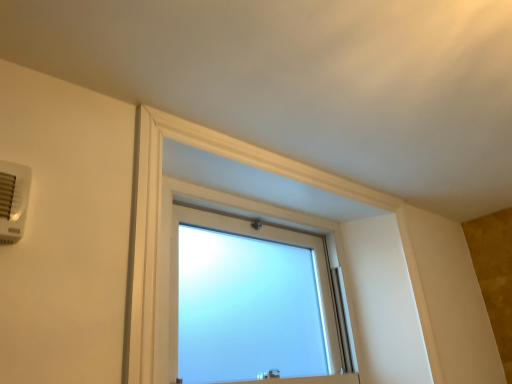
In order to face frosted glass window at upper center, should I rotate leftwards or rightwards?

You should look right and rotate roughly 8.409 degrees.

Where is `white plastic air conditioning unit at upper left`? This screenshot has height=384, width=512. white plastic air conditioning unit at upper left is located at coordinates (13, 200).

What is the approximate width of frosted glass window at center?

frosted glass window at center is 3.71 inches wide.

The image size is (512, 384). Find the location of `frosted glass window at upper center`. frosted glass window at upper center is located at coordinates (159, 219).

Considering their positions, is white plastic air conditioning unit at upper left located in front of or behind frosted glass window at center?

In the image, white plastic air conditioning unit at upper left appears in front of frosted glass window at center.

Is point (4, 193) farther from viewer compared to point (258, 363)?

No, (4, 193) is closer to viewer.

How distant is white plastic air conditioning unit at upper left from frosted glass window at center?

white plastic air conditioning unit at upper left and frosted glass window at center are 36.18 inches apart.

Is white plastic air conditioning unit at upper left far away from frosted glass window at center?

Actually, white plastic air conditioning unit at upper left and frosted glass window at center are a little close together.

Which point is more distant from viewer, (30, 175) or (161, 189)?

Positioned behind is point (161, 189).

From a real-world perspective, is white plastic air conditioning unit at upper left above or below frosted glass window at upper center?

In terms of real-world spatial position, white plastic air conditioning unit at upper left is above frosted glass window at upper center.

From the image's perspective, which object appears higher, white plastic air conditioning unit at upper left or frosted glass window at upper center?

From the image's view, white plastic air conditioning unit at upper left is above.

From a real-world perspective, is frosted glass window at center located beneath white plastic air conditioning unit at upper left?

Yes, from a real-world perspective, frosted glass window at center is beneath white plastic air conditioning unit at upper left.

Considering the positions of objects frosted glass window at center and white plastic air conditioning unit at upper left in the image provided, who is behind, frosted glass window at center or white plastic air conditioning unit at upper left?

frosted glass window at center is further away from the camera.

Is frosted glass window at center positioned with its back to white plastic air conditioning unit at upper left?

No, frosted glass window at center is not facing away from white plastic air conditioning unit at upper left.

In the scene shown: Which is closer, [227,308] or [0,174]?

The point [0,174] is closer.

Can you confirm if frosted glass window at upper center is bigger than frosted glass window at center?

No.

From the image's perspective, which object appears higher, frosted glass window at upper center or frosted glass window at center?

frosted glass window at upper center is shown above in the image.

From a real-world perspective, is frosted glass window at upper center positioned under frosted glass window at center based on gravity?

Incorrect, from a real-world perspective, frosted glass window at upper center is higher than frosted glass window at center.

Based on their positions, is frosted glass window at upper center located to the left or right of frosted glass window at center?

Clearly, frosted glass window at upper center is on the right of frosted glass window at center in the image.

How many degrees apart are the facing directions of frosted glass window at center and frosted glass window at upper center?

The angular difference between frosted glass window at center and frosted glass window at upper center is 0.00699 degrees.

Considering the sizes of objects frosted glass window at center and frosted glass window at upper center in the image provided, who is shorter, frosted glass window at center or frosted glass window at upper center?

Standing shorter between the two is frosted glass window at center.

In the scene shown: Which object is more forward, frosted glass window at center or frosted glass window at upper center?

frosted glass window at upper center is closer to the camera.

Which is farther from the camera, (311,370) or (134,161)?

The point (311,370) is farther from the camera.

Considering the positions of objects frosted glass window at upper center and white plastic air conditioning unit at upper left in the image provided, who is in front, frosted glass window at upper center or white plastic air conditioning unit at upper left?

white plastic air conditioning unit at upper left is in front.

Can you tell me how much frosted glass window at upper center and white plastic air conditioning unit at upper left differ in facing direction?

1.26 degrees.

Is white plastic air conditioning unit at upper left at the back of frosted glass window at upper center?

No, white plastic air conditioning unit at upper left is not at the back of frosted glass window at upper center.

Considering the sizes of objects frosted glass window at upper center and white plastic air conditioning unit at upper left in the image provided, who is bigger, frosted glass window at upper center or white plastic air conditioning unit at upper left?

frosted glass window at upper center.

Find the location of `window behind the white plastic air conditioning unit at upper left`. window behind the white plastic air conditioning unit at upper left is located at coordinates (247, 301).

The image size is (512, 384). I want to click on bay window located below the white plastic air conditioning unit at upper left (from the image's perspective), so click(159, 219).

From the image, which object appears to be nearer to frosted glass window at center, frosted glass window at upper center or white plastic air conditioning unit at upper left?

frosted glass window at upper center is positioned closer to the anchor frosted glass window at center.

From the image, which object appears to be nearer to white plastic air conditioning unit at upper left, frosted glass window at upper center or frosted glass window at center?

frosted glass window at upper center lies closer to white plastic air conditioning unit at upper left than the other object.

Estimate the real-world distances between objects in this image. Which object is closer to white plastic air conditioning unit at upper left, frosted glass window at center or frosted glass window at upper center?

frosted glass window at upper center is positioned closer to the anchor white plastic air conditioning unit at upper left.

Considering their positions, is white plastic air conditioning unit at upper left positioned further to frosted glass window at upper center than frosted glass window at center?

white plastic air conditioning unit at upper left.

Considering their positions, is frosted glass window at center positioned further to frosted glass window at upper center than white plastic air conditioning unit at upper left?

white plastic air conditioning unit at upper left.

Looking at the image, which one is located closer to frosted glass window at center, white plastic air conditioning unit at upper left or frosted glass window at upper center?

Based on the image, frosted glass window at upper center appears to be nearer to frosted glass window at center.

At what (x,y) coordinates should I click in order to perform the action: click on window located between white plastic air conditioning unit at upper left and frosted glass window at upper center in the left-right direction. Please return your answer as a coordinate pair (x, y). Looking at the image, I should click on (247, 301).